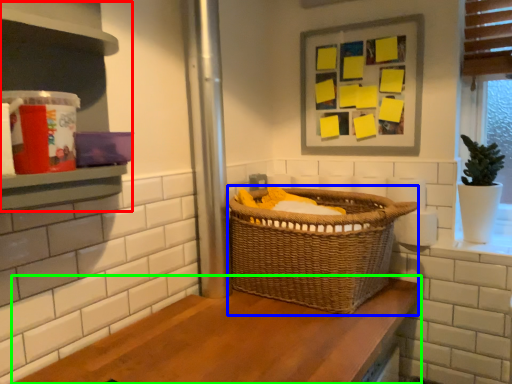
Question: Based on their relative distances, which object is farther from shelf (highlighted by a red box)? Choose from basket (highlighted by a blue box) and counter (highlighted by a green box).

Choices:
 (A) basket
 (B) counter

Answer: (A)